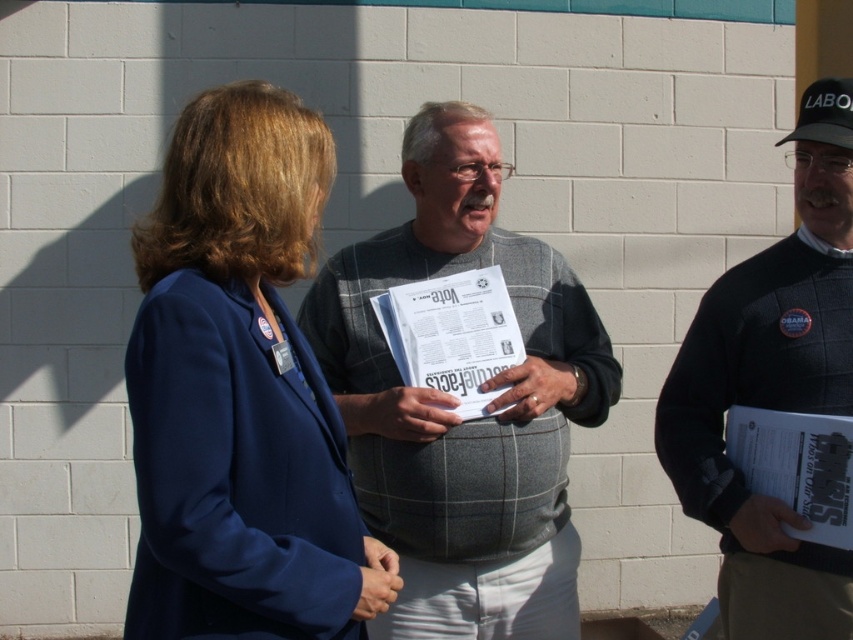
Question: Is navy blue blazer at center further to camera compared to black sweater at center?

Choices:
 (A) yes
 (B) no

Answer: (B)

Question: Which of the following is the farthest from the observer?

Choices:
 (A) (792, 369)
 (B) (177, 330)

Answer: (A)

Question: Where is black sweater at center located in relation to white paper at center in the image?

Choices:
 (A) right
 (B) left

Answer: (A)

Question: Estimate the real-world distances between objects in this image. Which object is closer to the navy blue blazer at center?

Choices:
 (A) black sweater at center
 (B) gray plaid sweater at center
 (C) white paper at center

Answer: (C)

Question: Considering the real-world distances, which object is closest to the black sweater at center?

Choices:
 (A) navy blue blazer at center
 (B) white paper at center
 (C) gray plaid sweater at center

Answer: (C)

Question: Is navy blue blazer at center thinner than black sweater at center?

Choices:
 (A) yes
 (B) no

Answer: (B)